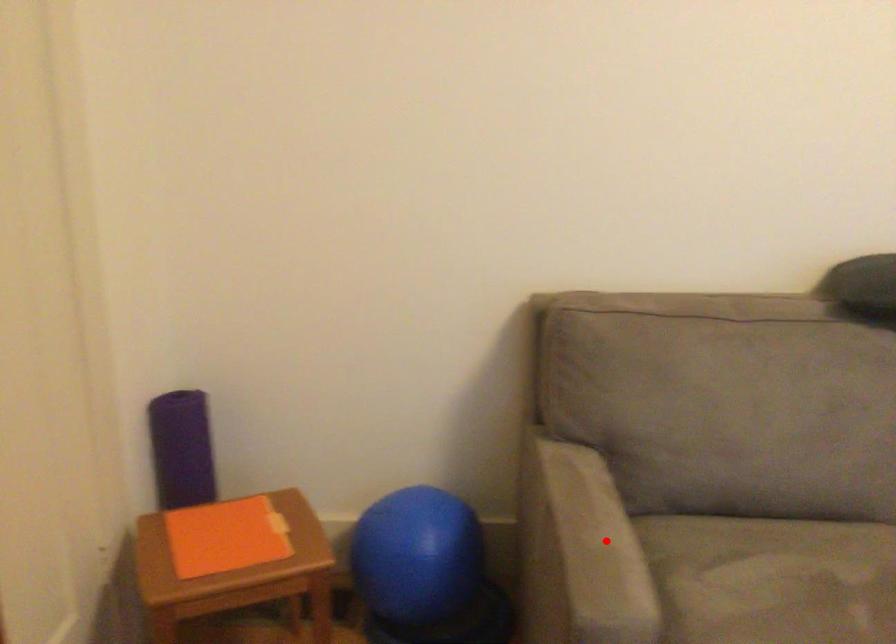
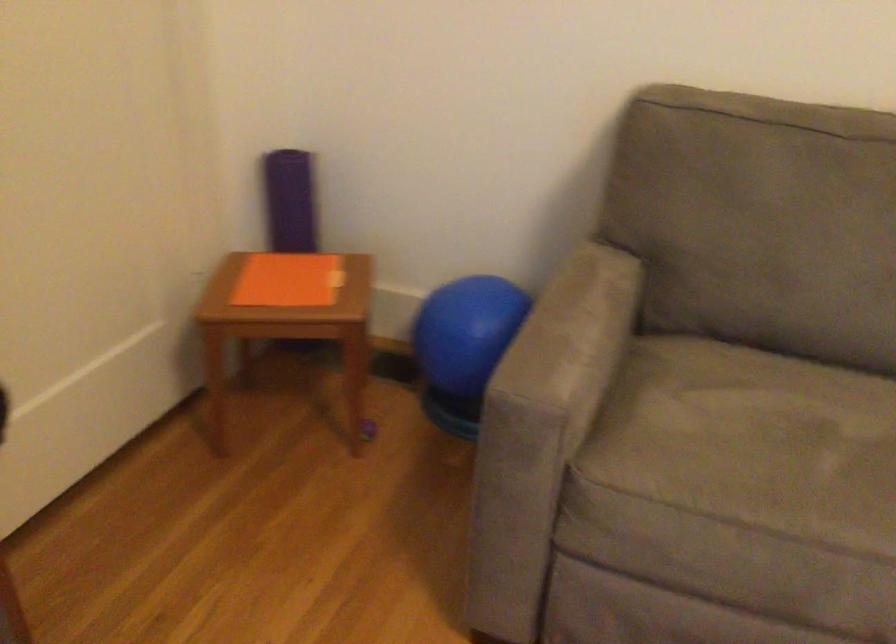
Question: I am providing you with two images of the same scene from different viewpoints. A red point is marked on the first image. Is the red point's position out of view in image 2?

Choices:
 (A) Yes
 (B) No

Answer: (B)